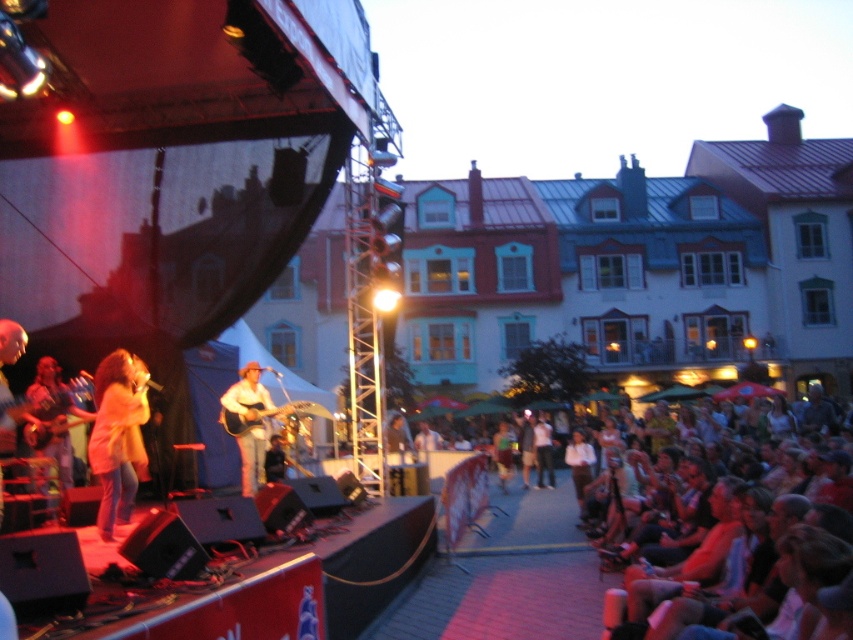
You are a stagehand preparing to move the light brown leather jacket at stage left and the light brown acoustic guitar at center stage. Since you need to know which item requires more space to transport, which one has a greater width?

The light brown acoustic guitar at center stage has a greater width compared to the light brown leather jacket at stage left, so it requires more space to transport.

You are a photographer positioned at the center of the stage. You need to capture a closeup shot of the light brown leather jacket at stage left. Which direction should you move to get closer to it?

The light brown leather jacket at stage left is located at point (117, 435), so you should move to the left to get closer to it.